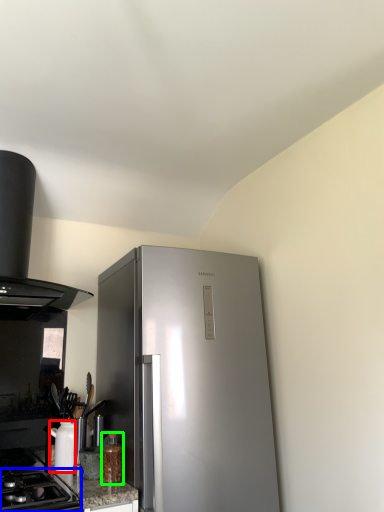
Question: Which object is the closest to the appliance (highlighted by a red box)? Choose among these: gas stove (highlighted by a blue box) or bottle (highlighted by a green box).

Choices:
 (A) gas stove
 (B) bottle

Answer: (A)